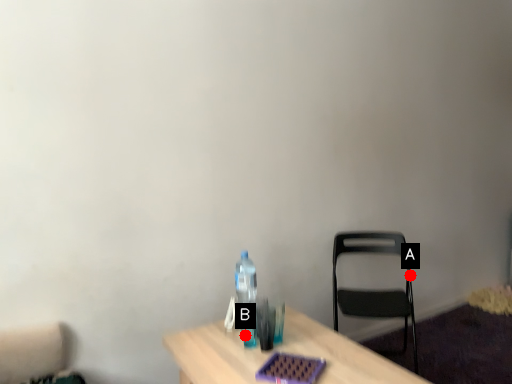
Question: Two points are circled on the image, labeled by A and B beside each circle. Which of the following is the closest to the observer?

Choices:
 (A) A is closer
 (B) B is closer

Answer: (B)